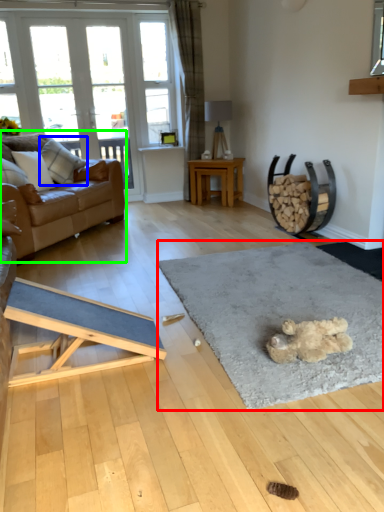
Question: Which is nearer to the mat (highlighted by a red box)? pillow (highlighted by a blue box) or studio couch (highlighted by a green box).

Choices:
 (A) pillow
 (B) studio couch

Answer: (B)